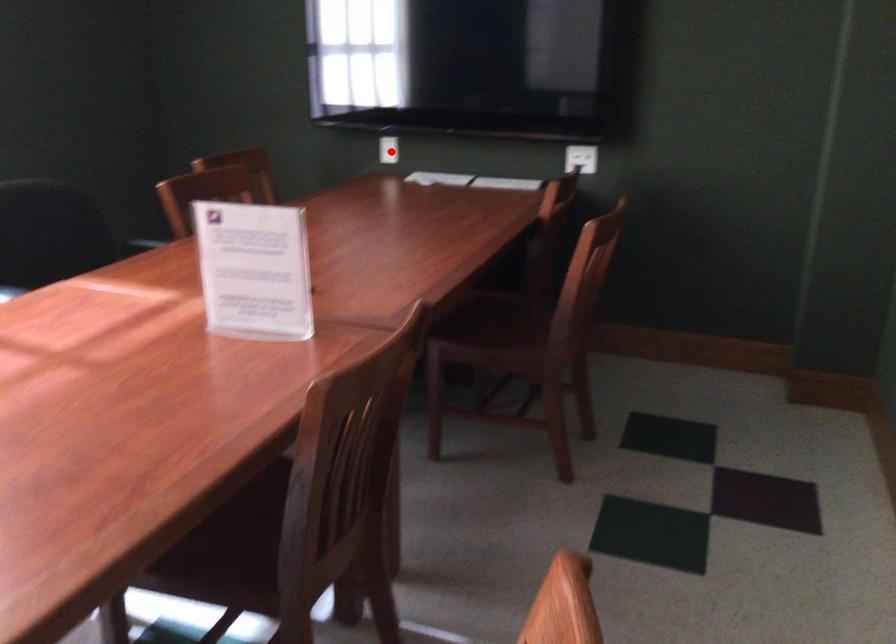
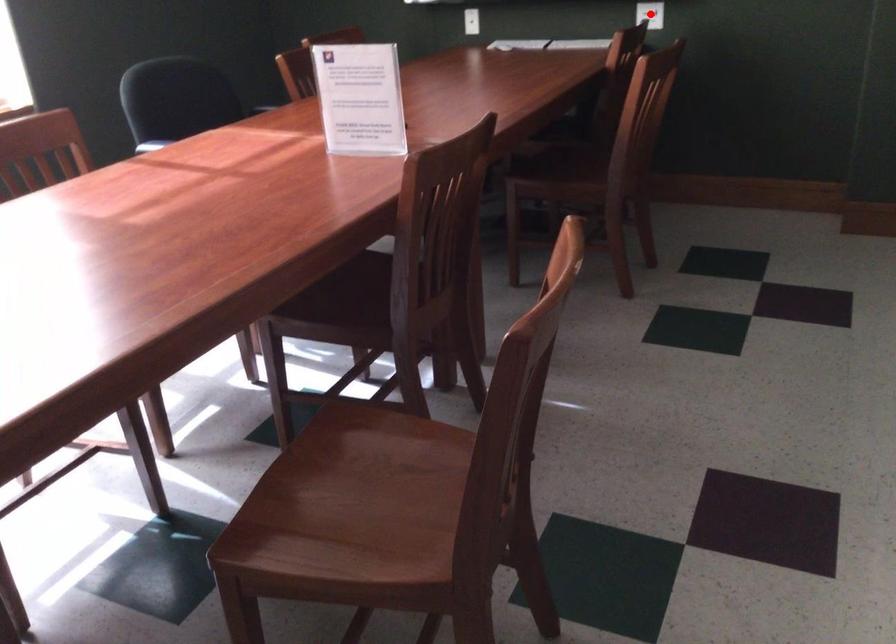
I am providing you with two images of the same scene from different viewpoints. A red point is marked on the first image and another point is marked on the second image. Is the red point in image1 aligned with the point shown in image2?

No